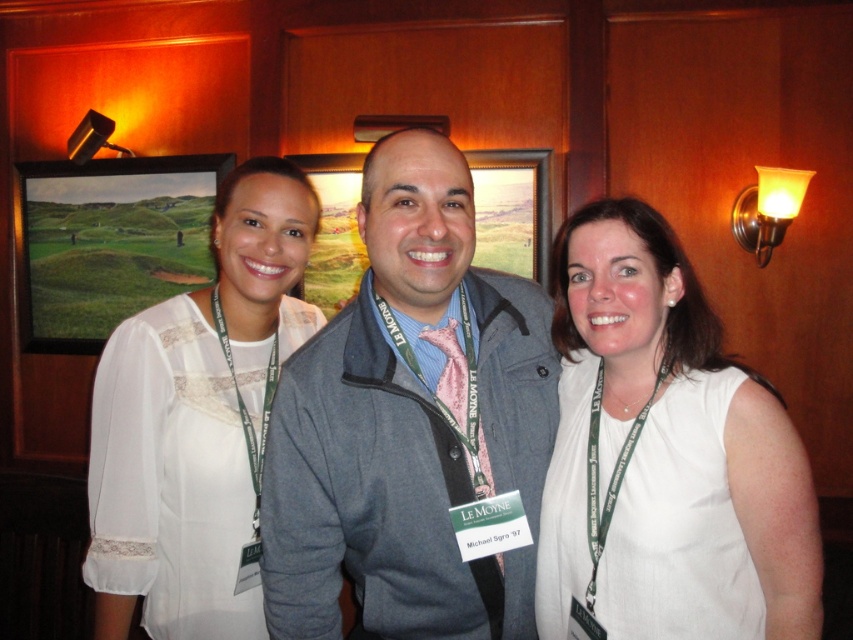
You are a photographer trying to adjust the lighting for a group photo. You notice the gray fabric jacket at center and the white fabric shirt at center. Which item requires more space in the frame to accommodate its size?

The gray fabric jacket at center is larger in size than the white fabric shirt at center, so it requires more space in the frame.

You are a photographer adjusting the camera focus. You need to ensure both the white fabric shirt at center and the green matte picture frame at upper left are in focus. Which object is narrower so you can adjust the focus accordingly?

The white fabric shirt at center has a lesser width compared to the green matte picture frame at upper left, so you should adjust the focus to the narrower white fabric shirt at center first.

You are a photographer adjusting your camera settings for a group photo. You notice the white fabric shirt at center and the green matte picture frame at upper left in your viewfinder. Which object should you focus on if you want to ensure the larger object is in sharp focus?

The green matte picture frame at upper left is larger, so you should focus on it to ensure the larger object is in sharp focus.